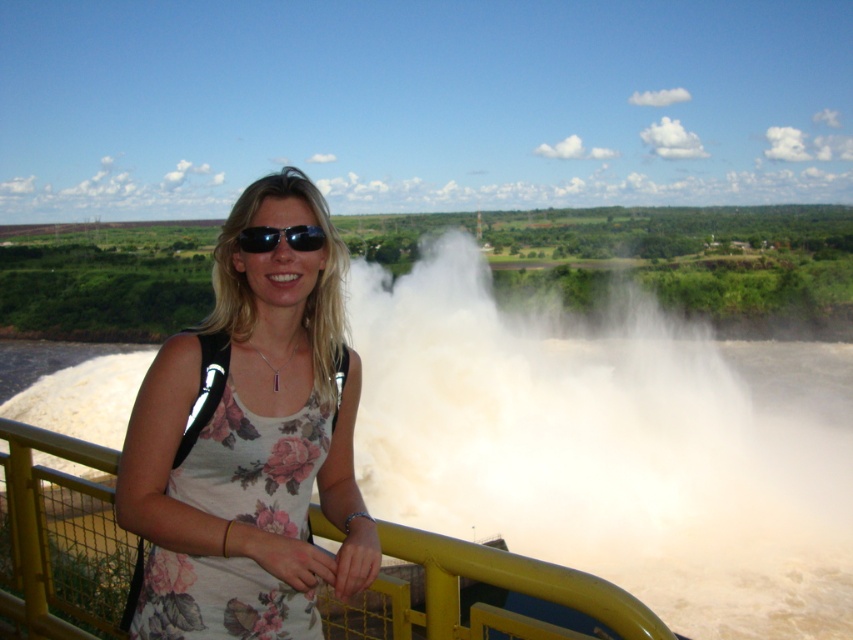
You are a photographer trying to capture the woman in the floral fabric dress at center without getting your camera wet. The white frothy water at center is spraying mist. Based on their positions, is the dress likely to get wet from the waterfall spray?

The white frothy water at center is positioned under the floral fabric dress at center, so the waterfall spray is below the dress. The dress is unlikely to get wet from the waterfall spray.

From the picture: You are a photographer positioned at the waterfall. You want to take a photo of the floral fabric dress at center and the yellow metal railing at center. Which object should you focus on first to ensure the subject is in sharp focus?

The floral fabric dress at center is closer to you than the yellow metal railing at center, so focus on the floral fabric dress at center first to ensure it is in sharp focus.